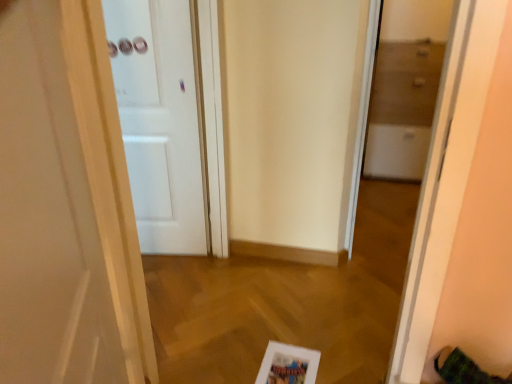
What are the coordinates of `empty space that is ontop of white matte picture frame at lower center` in the screenshot? It's located at (285, 367).